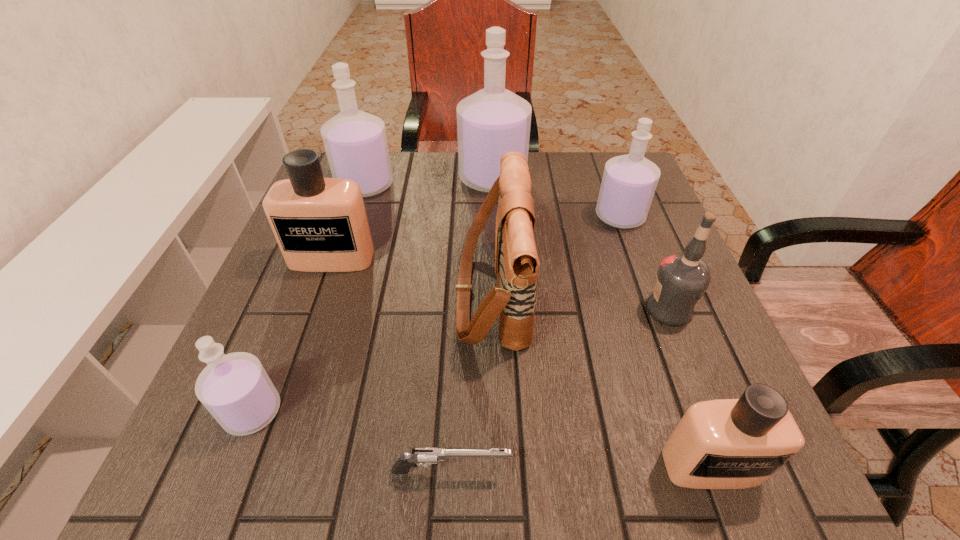
Where is `the second nearest perfume`? the second nearest perfume is located at coordinates (235, 388).

This screenshot has width=960, height=540. I want to click on the nearest perfume, so click(739, 443).

Locate an element on the screen. The height and width of the screenshot is (540, 960). the smaller beige perfume is located at coordinates (739, 443).

Identify the location of silver pistol. This screenshot has height=540, width=960. (424, 456).

This screenshot has height=540, width=960. Find the location of `the shortest object`. the shortest object is located at coordinates (424, 456).

In order to click on vacant area situated on the left of the tallest object in this screenshot , I will do pos(345,179).

Identify the location of free space located 0.380m on the right of the second tallest perfume. (541, 186).

Locate an element on the screen. free space located on the back of the rightmost purple perfume is located at coordinates (610, 188).

This screenshot has height=540, width=960. Identify the location of vacant space located 0.320m on the front label of the fourth farthest perfume. (276, 418).

This screenshot has width=960, height=540. What are the coordinates of `vacant space situated on the front-facing side of the shoulder bag` in the screenshot? It's located at (328, 293).